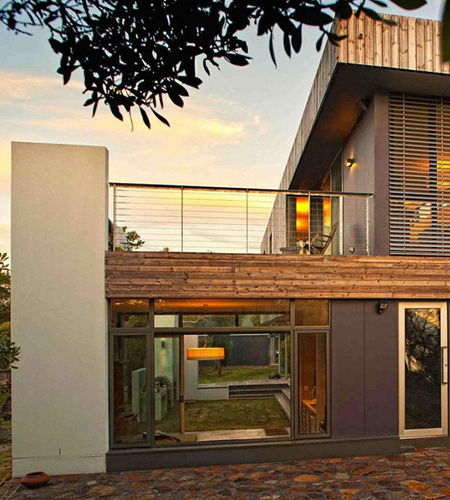
Where is `light`? The height and width of the screenshot is (500, 450). light is located at coordinates (347, 163).